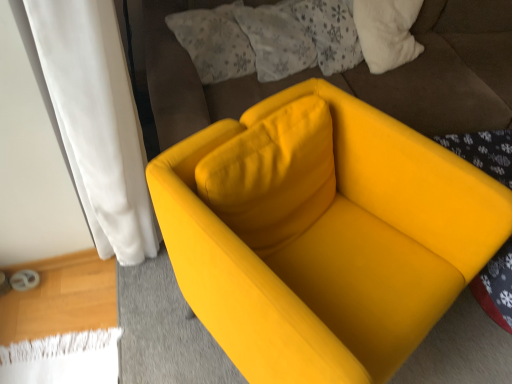
Question: Is fluffy white pillow at upper center, marked as the second pillow in a right-to-left arrangement, wider or thinner than fluffy white pillow at upper center, the 2th pillow from the left?

Choices:
 (A) thin
 (B) wide

Answer: (B)

Question: Based on their sizes in the image, would you say fluffy white pillow at upper center, marked as the second pillow in a right-to-left arrangement, is bigger or smaller than fluffy white pillow at upper center, the 1th pillow viewed from the right?

Choices:
 (A) big
 (B) small

Answer: (A)

Question: Estimate the real-world distances between objects in this image. Which object is farther from the matte yellow armchair at center?

Choices:
 (A) matte yellow armchair at center
 (B) fluffy white pillow at upper center, the 1th pillow viewed from the right
 (C) fluffy white pillow at upper center, placed as the 1th pillow when sorted from left to right

Answer: (A)

Question: Estimate the real-world distances between objects in this image. Which object is closer to the matte yellow armchair at center?

Choices:
 (A) fluffy white pillow at upper center, placed as the 1th pillow when sorted from left to right
 (B) matte yellow armchair at center
 (C) fluffy white pillow at upper center, the 2th pillow from the left

Answer: (C)